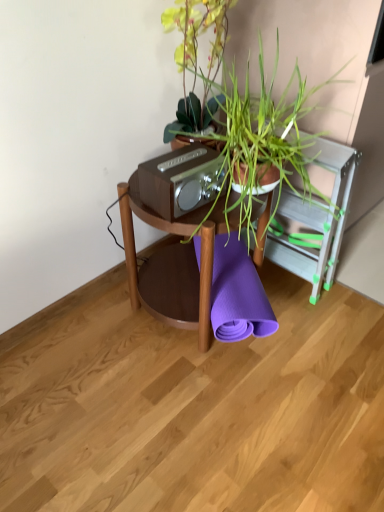
Identify the location of purple rubber yoga mat at center. This screenshot has width=384, height=512. (238, 293).

The image size is (384, 512). What are the coordinates of `matte brown stereo at center` in the screenshot? It's located at (180, 180).

I want to click on woodenmaterial/texturetable at center, so click(x=172, y=264).

Where is `green leafy plant at center`? green leafy plant at center is located at coordinates (239, 101).

Is purple rubber yoga mat at center positioned beyond the bounds of green leafy plant at center?

Absolutely, purple rubber yoga mat at center is external to green leafy plant at center.

From a real-world perspective, which is physically above, purple rubber yoga mat at center or green leafy plant at center?

From a 3D spatial view, green leafy plant at center is above.

Consider the image. In the image, is purple rubber yoga mat at center on the left side or the right side of green leafy plant at center?

From the image, it's evident that purple rubber yoga mat at center is to the left of green leafy plant at center.

Does purple rubber yoga mat at center have a greater width compared to green leafy plant at center?

Correct, the width of purple rubber yoga mat at center exceeds that of green leafy plant at center.

Are purple rubber yoga mat at center and woodenmaterial/texturetable at center located far from each other?

purple rubber yoga mat at center is actually quite close to woodenmaterial/texturetable at center.

The width and height of the screenshot is (384, 512). Find the location of `beach towel lying below the woodenmaterial/texturetable at center (from the image's perspective)`. beach towel lying below the woodenmaterial/texturetable at center (from the image's perspective) is located at coordinates point(238,293).

Between purple rubber yoga mat at center and woodenmaterial/texturetable at center, which one has more height?

woodenmaterial/texturetable at center.

From the image's perspective, does purple rubber yoga mat at center appear lower than woodenmaterial/texturetable at center?

Indeed, from the image's perspective, purple rubber yoga mat at center is shown beneath woodenmaterial/texturetable at center.

From a real-world perspective, is purple rubber yoga mat at center beneath matte brown stereo at center?

Yes, from a real-world perspective, purple rubber yoga mat at center is beneath matte brown stereo at center.

Considering the positions of objects purple rubber yoga mat at center and matte brown stereo at center in the image provided, who is behind, purple rubber yoga mat at center or matte brown stereo at center?

purple rubber yoga mat at center is further from the camera.

Is purple rubber yoga mat at center not close to matte brown stereo at center?

That's not correct — purple rubber yoga mat at center is a little close to matte brown stereo at center.

Is point (211, 315) closer or farther from the camera than point (158, 202)?

Point (211, 315) is farther from the camera than point (158, 202).

Identify the location of houseplant that appears in front of the purple rubber yoga mat at center. The width and height of the screenshot is (384, 512). (239, 101).

Which is closer to the camera, [267,95] or [236,339]?

Clearly, point [267,95] is closer to the camera than point [236,339].

From the image's perspective, which one is positioned higher, green leafy plant at center or purple rubber yoga mat at center?

From the image's view, green leafy plant at center is above.

Considering the relative sizes of green leafy plant at center and purple rubber yoga mat at center in the image provided, is green leafy plant at center thinner than purple rubber yoga mat at center?

Yes, green leafy plant at center is thinner than purple rubber yoga mat at center.

Does woodenmaterial/texturetable at center appear on the left side of green leafy plant at center?

Indeed, woodenmaterial/texturetable at center is positioned on the left side of green leafy plant at center.

Locate an element on the screen. houseplant that is on the right side of woodenmaterial/texturetable at center is located at coordinates (239, 101).

Between woodenmaterial/texturetable at center and green leafy plant at center, which one has smaller width?

With smaller width is woodenmaterial/texturetable at center.

Can you tell me how much matte brown stereo at center and green leafy plant at center differ in facing direction?

There is a 4.96-degree angle between the facing directions of matte brown stereo at center and green leafy plant at center.

Is point (182, 173) positioned in front of point (339, 70)?

Yes.

From a real-world perspective, does matte brown stereo at center sit lower than green leafy plant at center?

Indeed, from a real-world perspective, matte brown stereo at center is positioned beneath green leafy plant at center.

Does matte brown stereo at center have a greater height compared to green leafy plant at center?

Incorrect, the height of matte brown stereo at center is not larger of that of green leafy plant at center.

Between woodenmaterial/texturetable at center and purple rubber yoga mat at center, which one has more height?

woodenmaterial/texturetable at center is taller.

Does woodenmaterial/texturetable at center touch purple rubber yoga mat at center?

No, woodenmaterial/texturetable at center is not next to purple rubber yoga mat at center.

Considering the sizes of woodenmaterial/texturetable at center and purple rubber yoga mat at center in the image, is woodenmaterial/texturetable at center bigger or smaller than purple rubber yoga mat at center?

Considering their sizes, woodenmaterial/texturetable at center takes up more space than purple rubber yoga mat at center.

The image size is (384, 512). What are the coordinates of `houseplant that appears above the purple rubber yoga mat at center (from a real-world perspective)` in the screenshot? It's located at (239, 101).

Find the location of a particular element. This screenshot has height=512, width=384. table on the left of purple rubber yoga mat at center is located at coordinates (172, 264).

From the picture: Which object lies nearer to the anchor point green leafy plant at center, purple rubber yoga mat at center or matte brown stereo at center?

matte brown stereo at center lies closer to green leafy plant at center than the other object.

Which object lies nearer to the anchor point green leafy plant at center, matte brown stereo at center or woodenmaterial/texturetable at center?

matte brown stereo at center is closer to green leafy plant at center.

When comparing their distances from purple rubber yoga mat at center, does matte brown stereo at center or green leafy plant at center seem closer?

matte brown stereo at center is closer to purple rubber yoga mat at center.

From the image, which object appears to be nearer to purple rubber yoga mat at center, woodenmaterial/texturetable at center or green leafy plant at center?

woodenmaterial/texturetable at center is positioned closer to the anchor purple rubber yoga mat at center.

Estimate the real-world distances between objects in this image. Which object is further from matte brown stereo at center, woodenmaterial/texturetable at center or green leafy plant at center?

woodenmaterial/texturetable at center lies further to matte brown stereo at center than the other object.

Estimate the real-world distances between objects in this image. Which object is further from purple rubber yoga mat at center, woodenmaterial/texturetable at center or matte brown stereo at center?

matte brown stereo at center lies further to purple rubber yoga mat at center than the other object.

Estimate the real-world distances between objects in this image. Which object is closer to green leafy plant at center, woodenmaterial/texturetable at center or purple rubber yoga mat at center?

woodenmaterial/texturetable at center is positioned closer to the anchor green leafy plant at center.

Consider the image. Estimate the real-world distances between objects in this image. Which object is further from matte brown stereo at center, woodenmaterial/texturetable at center or purple rubber yoga mat at center?

purple rubber yoga mat at center is positioned further to the anchor matte brown stereo at center.

You are a GUI agent. You are given a task and a screenshot of the screen. Output one action in this format:
    pyautogui.click(x=<x>, y=<y>)
    Task: Click on the table between matte brown stereo at center and purple rubber yoga mat at center in the up-down direction
    This screenshot has height=512, width=384.
    Given the screenshot: What is the action you would take?
    pyautogui.click(x=172, y=264)

Identify the location of stereo between green leafy plant at center and woodenmaterial/texturetable at center in the front-back direction. (180, 180).

Find the location of `table positioned between green leafy plant at center and purple rubber yoga mat at center from near to far`. table positioned between green leafy plant at center and purple rubber yoga mat at center from near to far is located at coordinates (172, 264).

Where is `stereo positioned between green leafy plant at center and purple rubber yoga mat at center from near to far`? The width and height of the screenshot is (384, 512). stereo positioned between green leafy plant at center and purple rubber yoga mat at center from near to far is located at coordinates (180, 180).